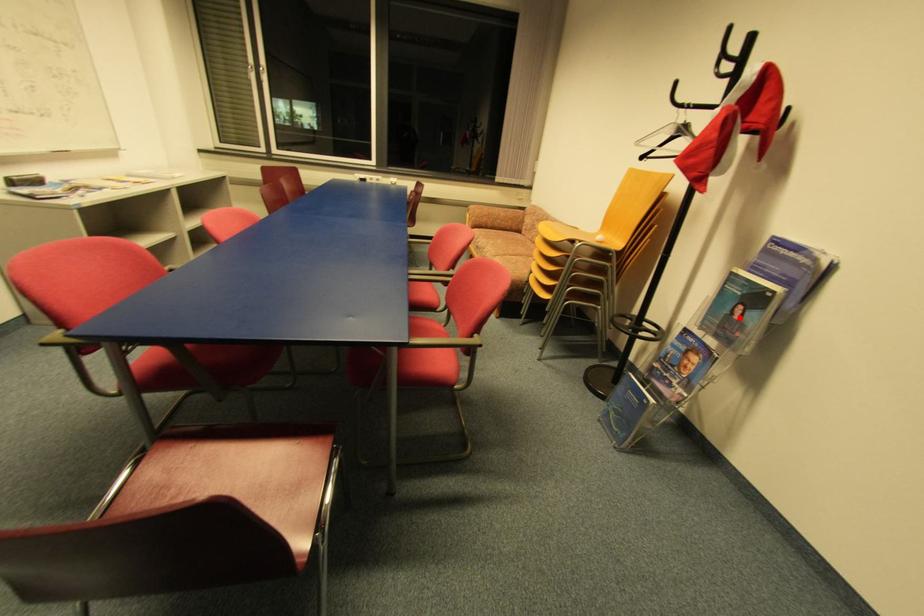
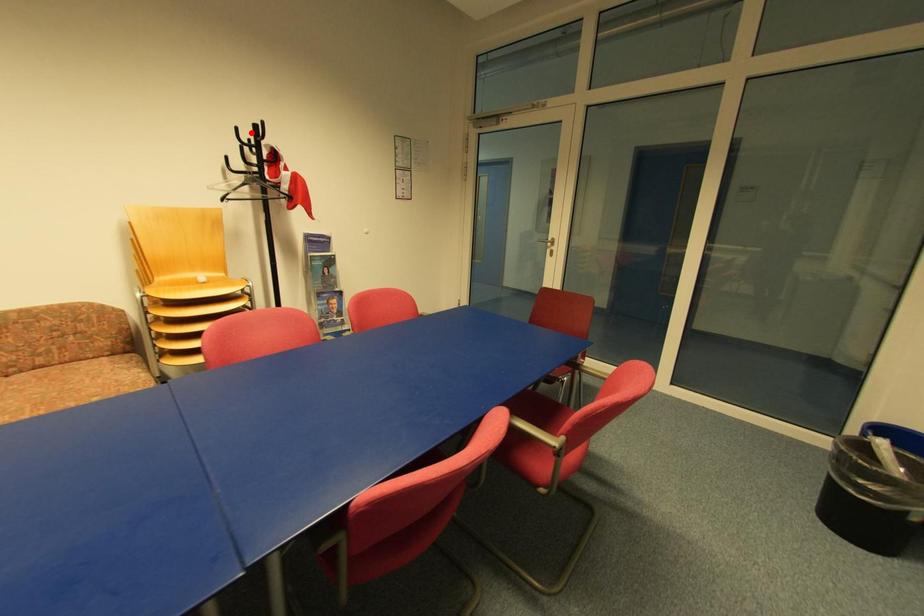
I am providing you with two images of the same scene from different viewpoints. A red point is marked on the first image and another point is marked on the second image. Does the point marked in image1 correspond to the same location as the one in image2?

No